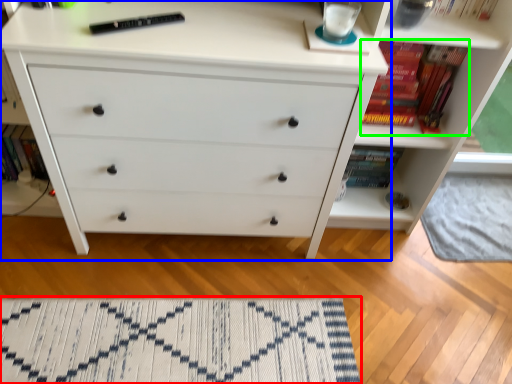
Question: Considering the real-world distances, which object is farthest from mat (highlighted by a red box)? chest of drawers (highlighted by a blue box) or book (highlighted by a green box)?

Choices:
 (A) chest of drawers
 (B) book

Answer: (B)